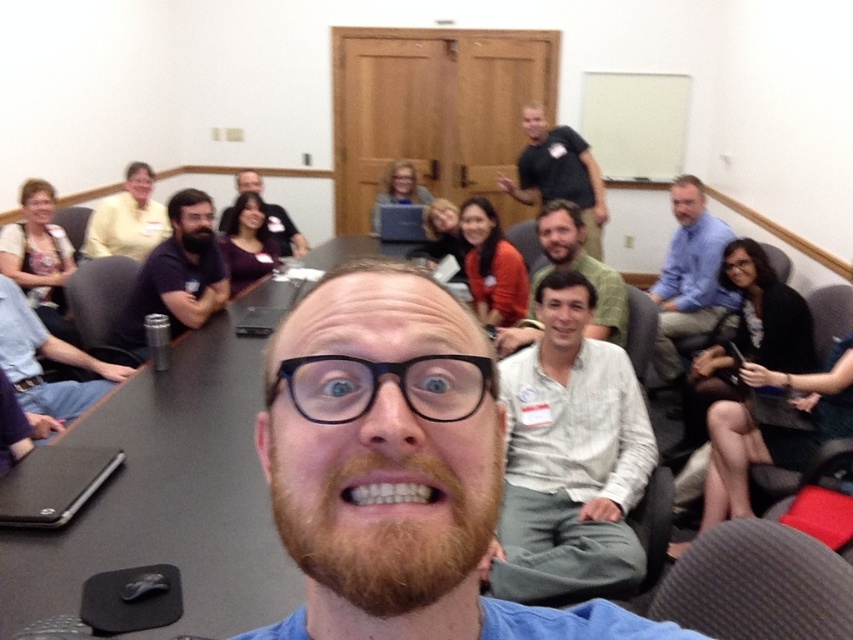
Question: Observing the image, what is the correct spatial positioning of black plastic table at center in reference to brown fuzzy beard at center?

Choices:
 (A) left
 (B) right

Answer: (B)

Question: Does matte yellow shirt at upper left lie in front of brown fuzzy beard at center?

Choices:
 (A) yes
 (B) no

Answer: (B)

Question: Which of the following is the farthest from the observer?

Choices:
 (A) (579, 168)
 (B) (256, 180)
 (C) (344, 492)
 (D) (193, 237)

Answer: (A)

Question: Which object is farther from the camera taking this photo?

Choices:
 (A) black plastic table at center
 (B) brown fuzzy beard at center
 (C) matte yellow shirt at upper left

Answer: (C)

Question: Does reddish-brown fuzzy beard at center have a larger size compared to black shirt at upper center?

Choices:
 (A) yes
 (B) no

Answer: (B)

Question: Among these points, which one is nearest to the camera?

Choices:
 (A) (132, 483)
 (B) (698, 182)
 (C) (202, 248)
 (D) (355, 442)

Answer: (D)